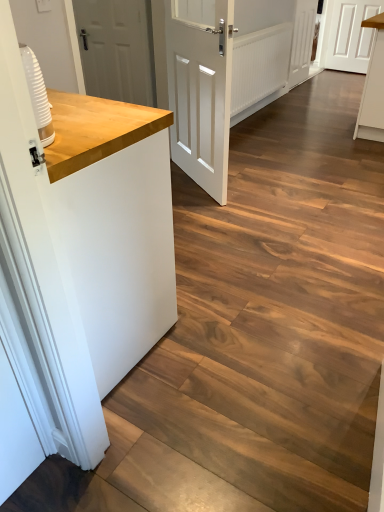
What do you see at coordinates (373, 87) in the screenshot?
I see `white matte cabinet at upper right` at bounding box center [373, 87].

Measure the distance between point (x=299, y=66) and camera.

4.83 meters.

In order to click on white wooden door at upper center, positioned as the 2th door in right-to-left order in this screenshot , I will do `click(302, 41)`.

What do you see at coordinates (200, 89) in the screenshot? I see `white matte door at center, the fourth door viewed from the back` at bounding box center [200, 89].

The width and height of the screenshot is (384, 512). I want to click on white matte door at center, which appears as the 3th door when viewed from the right, so click(200, 89).

Where is `white matte door at upper left, which is the second door from front to back`? white matte door at upper left, which is the second door from front to back is located at coordinates (117, 49).

Is the position of white matte door at upper left, which is the second door from front to back, more distant than that of white wooden door at upper right, positioned as the 1th door in right-to-left order?

No, white matte door at upper left, which is the second door from front to back, is closer to the camera.

Is white matte door at upper left, which is the 4th door in right-to-left order, situated inside white wooden door at upper right, placed as the 4th door when sorted from left to right, or outside?

white matte door at upper left, which is the 4th door in right-to-left order, cannot be found inside white wooden door at upper right, placed as the 4th door when sorted from left to right.

Which door is the 3rd one when counting from the left side of the white wooden door at upper right, positioned as the 1th door in right-to-left order? Please provide its 2D coordinates.

[(117, 49)]

Is white matte door at upper left, which is the 4th door in right-to-left order, bigger than white wooden door at upper right, the first door from the back?

No, white matte door at upper left, which is the 4th door in right-to-left order, is not bigger than white wooden door at upper right, the first door from the back.

Is white matte door at center, which appears as the 1th door when viewed from the front, facing away from white wooden door at upper center, positioned as the 2th door in right-to-left order?

white matte door at center, which appears as the 1th door when viewed from the front, does not have its back to white wooden door at upper center, positioned as the 2th door in right-to-left order.

From the picture: Which is less distant, (227, 169) or (306, 1)?

Clearly, point (227, 169) is closer to the camera than point (306, 1).

Is white matte door at center, which appears as the 1th door when viewed from the front, touching white wooden door at upper center, the third door in the front-to-back sequence?

They are not placed beside each other.

Between white matte door at center, which appears as the 1th door when viewed from the front, and white wooden door at upper center, the second door from the back, which one has more height?

Standing taller between the two is white matte door at center, which appears as the 1th door when viewed from the front.

Considering the positions of objects white wooden door at upper center, the second door from the back, and white matte door at center, which appears as the 3th door when viewed from the right, in the image provided, who is behind, white wooden door at upper center, the second door from the back, or white matte door at center, which appears as the 3th door when viewed from the right,?

white wooden door at upper center, the second door from the back, is more distant.

From a real-world perspective, which is physically above, white wooden door at upper center, the second door from the back, or white matte door at center, which appears as the 1th door when viewed from the front?

white matte door at center, which appears as the 1th door when viewed from the front, is physically above.

From the image's perspective, is white wooden door at upper center, positioned as the 2th door in right-to-left order, over white matte door at center, which appears as the 3th door when viewed from the right?

Yes, from the image's perspective, white wooden door at upper center, positioned as the 2th door in right-to-left order, is above white matte door at center, which appears as the 3th door when viewed from the right.

Is white matte door at center, acting as the second door starting from the left, a part of white wooden door at upper center, positioned as the 2th door in right-to-left order?

No, white wooden door at upper center, positioned as the 2th door in right-to-left order, does not contain white matte door at center, acting as the second door starting from the left.

Is white matte door at upper left, which is the 4th door in right-to-left order, closer to camera compared to white matte cabinet at upper right?

That is True.

Could you tell me if white matte door at upper left, which is the 4th door in right-to-left order, is facing white matte cabinet at upper right?

No.

How distant is white matte door at upper left, placed as the first door when sorted from left to right, from white matte cabinet at upper right?

white matte door at upper left, placed as the first door when sorted from left to right, is 1.82 meters away from white matte cabinet at upper right.

Considering the sizes of objects white matte door at upper left, which is the 4th door in right-to-left order, and white matte cabinet at upper right in the image provided, who is thinner, white matte door at upper left, which is the 4th door in right-to-left order, or white matte cabinet at upper right?

white matte door at upper left, which is the 4th door in right-to-left order, is thinner.

Find the location of a particular element. The image size is (384, 512). door that is the 1st one when counting forward from the white wooden door at upper right, the 4th door in the front-to-back sequence is located at coordinates (302, 41).

Who is smaller, white wooden door at upper center, the second door from the back, or white wooden door at upper right, the first door from the back?

white wooden door at upper center, the second door from the back, is smaller.

Is white wooden door at upper center, positioned as the 2th door in right-to-left order, turned away from white wooden door at upper right, positioned as the 1th door in right-to-left order?

white wooden door at upper center, positioned as the 2th door in right-to-left order, is not turned away from white wooden door at upper right, positioned as the 1th door in right-to-left order.

How many degrees apart are the facing directions of white wooden door at upper center, positioned as the 2th door in right-to-left order, and white wooden door at upper right, the first door from the back?

98.4 degrees separate the facing orientations of white wooden door at upper center, positioned as the 2th door in right-to-left order, and white wooden door at upper right, the first door from the back.

Are white wooden door at upper center, the third door in the front-to-back sequence, and white matte door at upper left, which is the 4th door in right-to-left order, beside each other?

There is a gap between white wooden door at upper center, the third door in the front-to-back sequence, and white matte door at upper left, which is the 4th door in right-to-left order.

Can you confirm if white wooden door at upper center, which is the third door from left to right, is positioned to the left of white matte door at upper left, placed as the first door when sorted from left to right?

In fact, white wooden door at upper center, which is the third door from left to right, is to the right of white matte door at upper left, placed as the first door when sorted from left to right.

From a real-world perspective, who is located lower, white wooden door at upper center, the second door from the back, or white matte door at upper left, placed as the first door when sorted from left to right?

From a 3D spatial view, white wooden door at upper center, the second door from the back, is below.

How much distance is there between white wooden door at upper center, positioned as the 2th door in right-to-left order, and white matte door at upper left, which is the 4th door in right-to-left order?

white wooden door at upper center, positioned as the 2th door in right-to-left order, is 2.13 meters away from white matte door at upper left, which is the 4th door in right-to-left order.

Is point (379, 95) positioned in front of point (111, 33)?

Yes, it is in front of point (111, 33).

Is white matte door at upper left, which is the 4th door in right-to-left order, at the back of white matte cabinet at upper right?

No, white matte cabinet at upper right is not facing away from white matte door at upper left, which is the 4th door in right-to-left order.

Based on the photo, choose the correct answer: Is white matte cabinet at upper right inside white matte door at upper left, placed as the first door when sorted from left to right, or outside it?

white matte cabinet at upper right is spatially situated outside white matte door at upper left, placed as the first door when sorted from left to right.

From a real-world perspective, starting from the white wooden door at upper right, the first door from the back, which door is the 2nd one vertically above it? Please provide its 2D coordinates.

[(117, 49)]

From a real-world perspective, starting from the white matte door at center, acting as the second door starting from the left, which door is the 2nd one below it? Please provide its 2D coordinates.

[(302, 41)]

From the image, which object appears to be nearer to white matte door at upper left, which is the 4th door in right-to-left order, white matte door at center, which appears as the 1th door when viewed from the front, or white wooden door at upper right, positioned as the 1th door in right-to-left order?

Based on the image, white matte door at center, which appears as the 1th door when viewed from the front, appears to be nearer to white matte door at upper left, which is the 4th door in right-to-left order.

Estimate the real-world distances between objects in this image. Which object is further from white matte door at upper left, the 3th door in the back-to-front sequence, white matte door at center, which appears as the 1th door when viewed from the front, or wooden countertop at left?

Among the two, wooden countertop at left is located further to white matte door at upper left, the 3th door in the back-to-front sequence.

Estimate the real-world distances between objects in this image. Which object is further from wooden countertop at left, white wooden door at upper right, the 4th door in the front-to-back sequence, or white matte door at upper left, which is the second door from front to back?

Among the two, white wooden door at upper right, the 4th door in the front-to-back sequence, is located further to wooden countertop at left.

When comparing their distances from white matte door at upper left, which is the 4th door in right-to-left order, does wooden countertop at left or white wooden door at upper center, the third door in the front-to-back sequence, seem closer?

wooden countertop at left lies closer to white matte door at upper left, which is the 4th door in right-to-left order, than the other object.

Based on their spatial positions, is white wooden door at upper right, positioned as the 1th door in right-to-left order, or wooden countertop at left closer to white wooden door at upper center, the third door in the front-to-back sequence?

white wooden door at upper right, positioned as the 1th door in right-to-left order, lies closer to white wooden door at upper center, the third door in the front-to-back sequence, than the other object.

When comparing their distances from white matte cabinet at upper right, does white wooden door at upper right, the first door from the back, or wooden countertop at left seem closer?

white wooden door at upper right, the first door from the back, lies closer to white matte cabinet at upper right than the other object.

Considering their positions, is white matte door at upper left, the 3th door in the back-to-front sequence, positioned closer to white matte cabinet at upper right than white matte door at center, which appears as the 3th door when viewed from the right?

Among the two, white matte door at center, which appears as the 3th door when viewed from the right, is located nearer to white matte cabinet at upper right.

From the image, which object appears to be farther from white wooden door at upper right, the first door from the back, white matte cabinet at upper right or white wooden door at upper center, positioned as the 2th door in right-to-left order?

white matte cabinet at upper right.

The width and height of the screenshot is (384, 512). I want to click on cabinetry between white matte door at center, the fourth door viewed from the back, and white wooden door at upper right, the first door from the back, from front to back, so click(373, 87).

The height and width of the screenshot is (512, 384). Find the location of `door between white matte cabinet at upper right and white wooden door at upper right, positioned as the 1th door in right-to-left order, along the z-axis`. door between white matte cabinet at upper right and white wooden door at upper right, positioned as the 1th door in right-to-left order, along the z-axis is located at coordinates (302, 41).

Find the location of a particular element. The width and height of the screenshot is (384, 512). door between wooden countertop at left and white matte door at upper left, placed as the first door when sorted from left to right, in the front-back direction is located at coordinates (200, 89).

Identify the location of door positioned between white matte door at center, which appears as the 1th door when viewed from the front, and white wooden door at upper center, which is the third door from left to right, from near to far. The width and height of the screenshot is (384, 512). (117, 49).